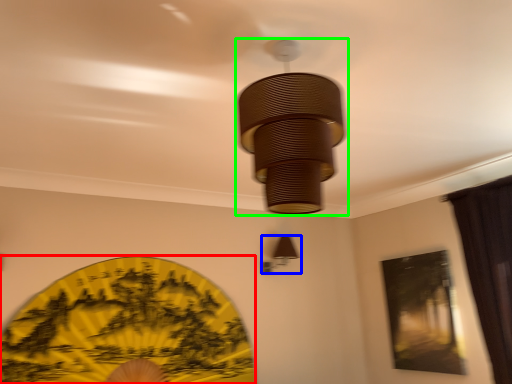
Question: Estimate the real-world distances between objects in this image. Which object is farther from design (highlighted by a red box), lamp (highlighted by a blue box) or lamp (highlighted by a green box)?

Choices:
 (A) lamp
 (B) lamp

Answer: (B)